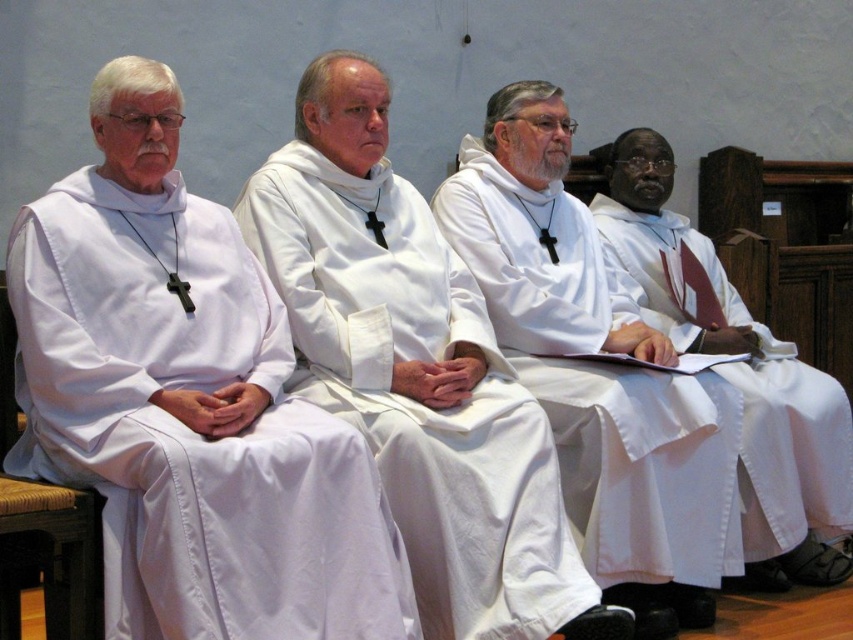
Question: Which of the following is the farthest from the observer?

Choices:
 (A) white matte robe at center
 (B) white matte/soft cloth robe at center
 (C) white satin robe at right
 (D) white matte robe at left

Answer: (C)

Question: Which object is the closest to the white matte/soft cloth robe at center?

Choices:
 (A) white matte robe at center
 (B) white matte robe at left
 (C) white satin robe at right

Answer: (B)

Question: Is white matte/soft cloth robe at center closer to camera compared to white satin robe at right?

Choices:
 (A) yes
 (B) no

Answer: (A)

Question: Which of the following is the closest to the observer?

Choices:
 (A) white matte robe at center
 (B) white matte/soft cloth robe at center
 (C) white satin robe at right

Answer: (B)

Question: Is white matte robe at left to the right of white matte/soft cloth robe at center from the viewer's perspective?

Choices:
 (A) no
 (B) yes

Answer: (A)

Question: Does white matte/soft cloth robe at center appear on the left side of white satin robe at right?

Choices:
 (A) yes
 (B) no

Answer: (A)